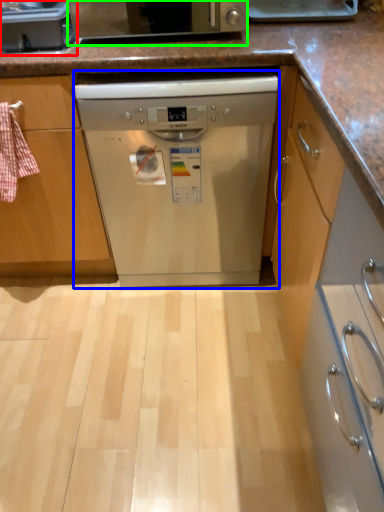
Question: Which object is positioned closest to kitchen appliance (highlighted by a red box)? Select from dishwasher (highlighted by a blue box) and home appliance (highlighted by a green box).

Choices:
 (A) dishwasher
 (B) home appliance

Answer: (B)